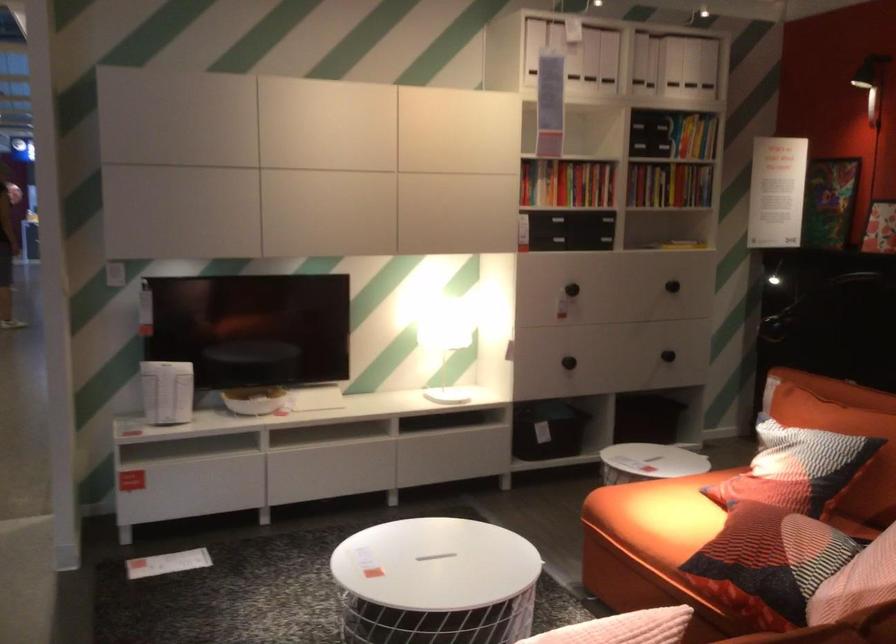
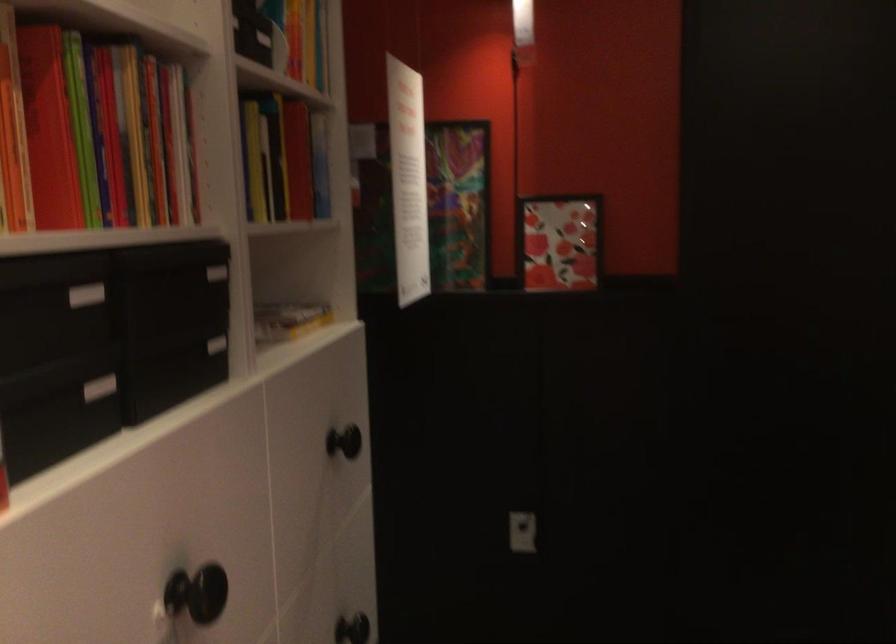
The point at [690,149] is marked in the first image. Where is the corresponding point in the second image?

(282, 158)